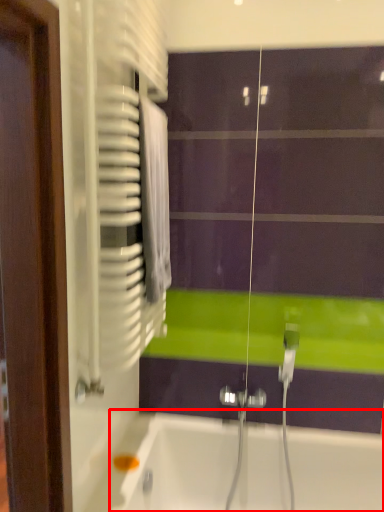
Question: From the image's perspective, where is bathtub (annotated by the red box) located relative to screen door?

Choices:
 (A) above
 (B) below

Answer: (B)